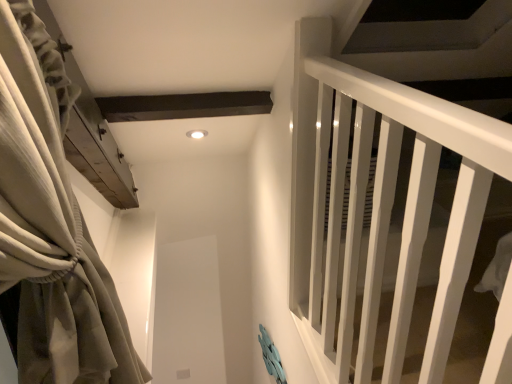
The width and height of the screenshot is (512, 384). What do you see at coordinates (51, 224) in the screenshot?
I see `satin beige curtain at left` at bounding box center [51, 224].

What are the coordinates of `satin beige curtain at left` in the screenshot? It's located at (51, 224).

This screenshot has width=512, height=384. I want to click on satin beige curtain at left, so click(x=51, y=224).